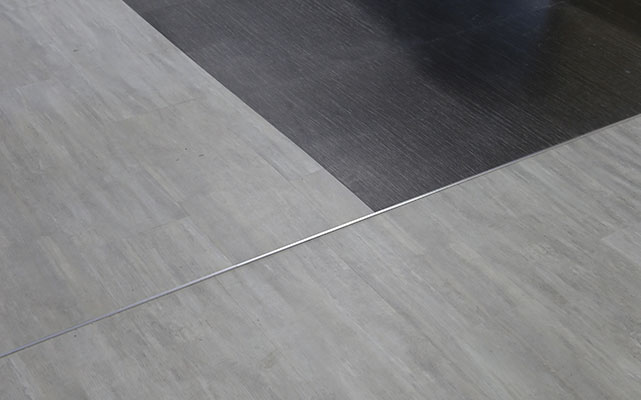
Identify the location of white shape with square end in gray flooring. (308, 165).